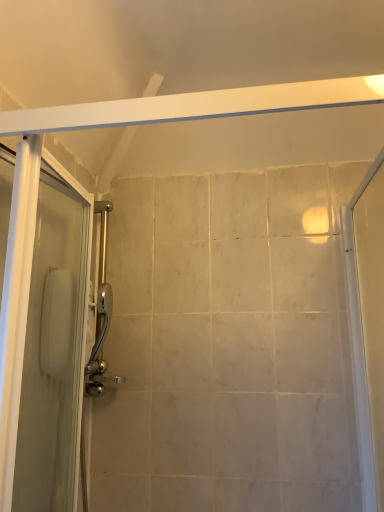
The height and width of the screenshot is (512, 384). What do you see at coordinates (42, 339) in the screenshot?
I see `white glossy screen door at left` at bounding box center [42, 339].

Find the location of a particular element. white glossy screen door at left is located at coordinates (42, 339).

In order to face white glossy screen door at left, should I rotate leftwards or rightwards?

You should look left and rotate roughly 19.952 degrees.

In order to click on white glossy screen door at left in this screenshot , I will do `click(42, 339)`.